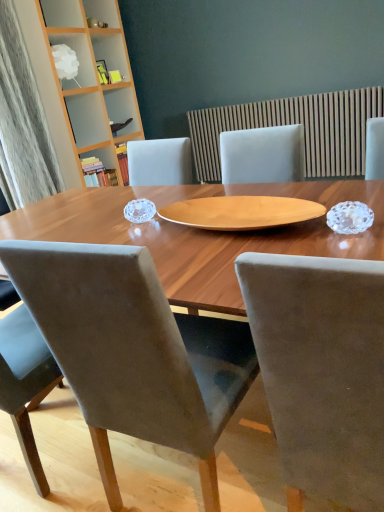
Question: Is white frosted glass lampshade at upper left, the 1th shelf positioned from the top, aimed at wooden slats at upper center?

Choices:
 (A) no
 (B) yes

Answer: (A)

Question: Considering the relative sizes of white frosted glass lampshade at upper left, the 1th shelf positioned from the top, and wooden slats at upper center in the image provided, is white frosted glass lampshade at upper left, the 1th shelf positioned from the top, smaller than wooden slats at upper center?

Choices:
 (A) yes
 (B) no

Answer: (A)

Question: Are white frosted glass lampshade at upper left, the 2th shelf in the bottom-to-top sequence, and wooden slats at upper center far apart?

Choices:
 (A) no
 (B) yes

Answer: (B)

Question: From the image's perspective, is white frosted glass lampshade at upper left, the 1th shelf positioned from the top, on top of wooden slats at upper center?

Choices:
 (A) no
 (B) yes

Answer: (B)

Question: From a real-world perspective, is white frosted glass lampshade at upper left, the 2th shelf in the bottom-to-top sequence, under wooden slats at upper center?

Choices:
 (A) yes
 (B) no

Answer: (B)

Question: In terms of width, does white frosted glass lampshade at upper left, the 2th shelf in the bottom-to-top sequence, look wider or thinner when compared to wooden slats at upper center?

Choices:
 (A) wide
 (B) thin

Answer: (A)

Question: From a real-world perspective, is white frosted glass lampshade at upper left, the 2th shelf in the bottom-to-top sequence, above or below wooden slats at upper center?

Choices:
 (A) below
 (B) above

Answer: (B)

Question: In the image, is white frosted glass lampshade at upper left, the 2th shelf in the bottom-to-top sequence, positioned in front of or behind wooden slats at upper center?

Choices:
 (A) behind
 (B) front

Answer: (A)

Question: Visually, is white frosted glass lampshade at upper left, the 2th shelf in the bottom-to-top sequence, positioned to the left or to the right of wooden slats at upper center?

Choices:
 (A) right
 (B) left

Answer: (B)

Question: Is velvet grey chair at center, the 1th chair viewed from the left, bigger or smaller than wooden bookshelf at upper left, the 1th shelf from the bottom?

Choices:
 (A) small
 (B) big

Answer: (B)

Question: Visually, is velvet grey chair at center, positioned as the second chair in right-to-left order, positioned to the left or to the right of wooden bookshelf at upper left, which is the second shelf from top to bottom?

Choices:
 (A) left
 (B) right

Answer: (B)

Question: In terms of height, does velvet grey chair at center, positioned as the second chair in right-to-left order, look taller or shorter compared to wooden bookshelf at upper left, which is the second shelf from top to bottom?

Choices:
 (A) tall
 (B) short

Answer: (A)

Question: Considering the positions of velvet grey chair at center, positioned as the second chair in right-to-left order, and wooden bookshelf at upper left, the 1th shelf from the bottom, in the image, is velvet grey chair at center, positioned as the second chair in right-to-left order, wider or thinner than wooden bookshelf at upper left, the 1th shelf from the bottom,?

Choices:
 (A) thin
 (B) wide

Answer: (B)

Question: From the image's perspective, is wooden bookshelf at upper left, the 1th shelf from the bottom, above or below white frosted glass lampshade at upper left, the 1th shelf positioned from the top?

Choices:
 (A) above
 (B) below

Answer: (B)

Question: Is wooden bookshelf at upper left, the 1th shelf from the bottom, inside or outside of white frosted glass lampshade at upper left, the 2th shelf in the bottom-to-top sequence?

Choices:
 (A) inside
 (B) outside

Answer: (B)